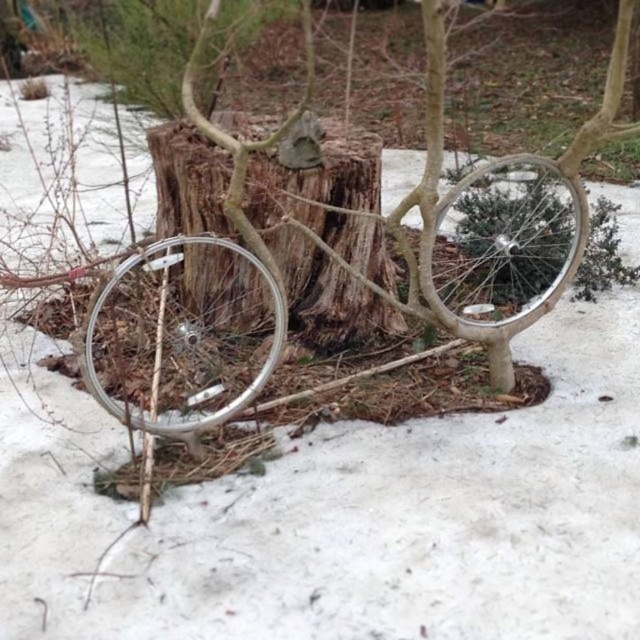
Which of these two, wooden tree stump at center or silver metallic wheel at center, stands taller?

silver metallic wheel at center

Who is positioned more to the left, wooden tree stump at center or silver metallic wheel at center?

wooden tree stump at center

What do you see at coordinates (328, 196) in the screenshot? This screenshot has width=640, height=640. I see `wooden tree stump at center` at bounding box center [328, 196].

Locate an element on the screen. The height and width of the screenshot is (640, 640). wooden tree stump at center is located at coordinates (328, 196).

Is silver metallic bicycle at center bigger than silver metallic wheel at left?

Yes, silver metallic bicycle at center is bigger than silver metallic wheel at left.

Find the location of `silver metallic bicycle at center`. silver metallic bicycle at center is located at coordinates (186, 336).

Is silver metallic wheel at left to the right of silver metallic wheel at center from the viewer's perspective?

Incorrect, silver metallic wheel at left is not on the right side of silver metallic wheel at center.

The image size is (640, 640). What do you see at coordinates (182, 333) in the screenshot?
I see `silver metallic wheel at left` at bounding box center [182, 333].

Is point (260, 294) less distant than point (525, 310)?

No, (260, 294) is behind (525, 310).

I want to click on silver metallic wheel at left, so click(182, 333).